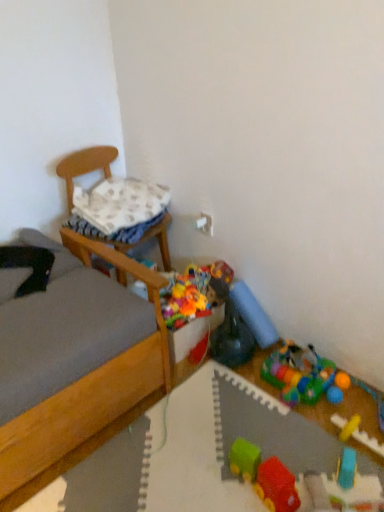
Where is `free spot above rubberized plastic play mat at lower right, the third toy viewed from the back (from a real-world perspective)`? This screenshot has width=384, height=512. free spot above rubberized plastic play mat at lower right, the third toy viewed from the back (from a real-world perspective) is located at coordinates (301, 367).